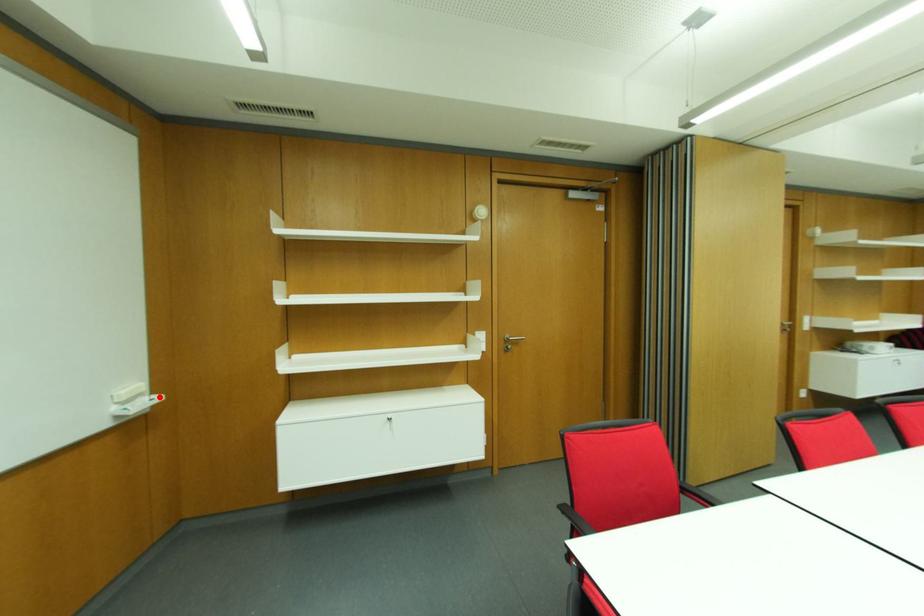
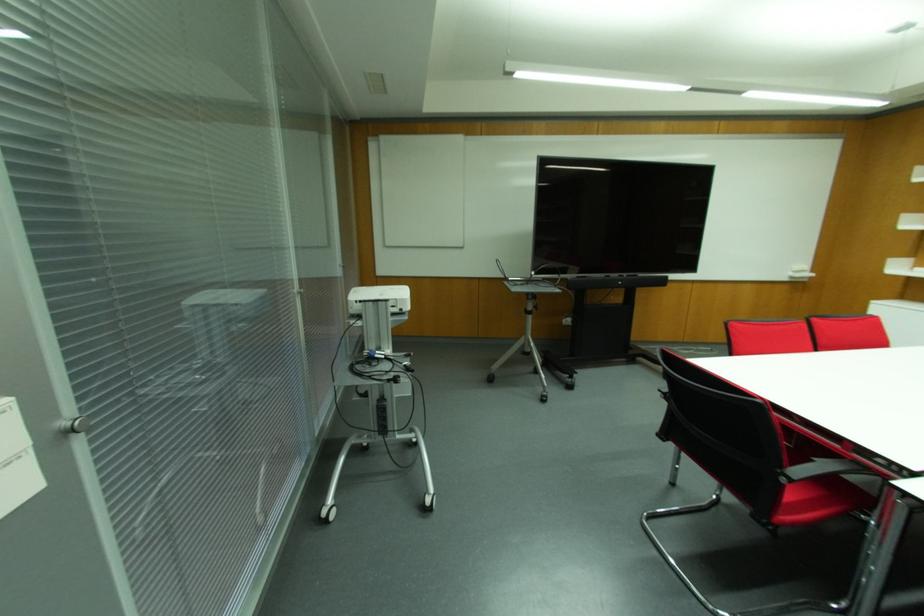
Question: I am providing you with two images of the same scene from different viewpoints. Image1 has a red point marked. In image2, the corresponding 3D location appears at what relative position? Reply with the corresponding letter.

Choices:
 (A) Closer
 (B) Farther

Answer: (B)